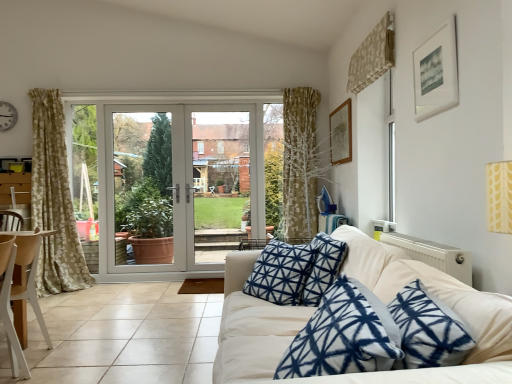
You are a GUI agent. You are given a task and a screenshot of the screen. Output one action in this format:
    pyautogui.click(x=<x>, y=<y>)
    Task: Click on the free point to the right of wooden chair at left
    The height and width of the screenshot is (384, 512).
    Given the screenshot: What is the action you would take?
    pyautogui.click(x=67, y=359)